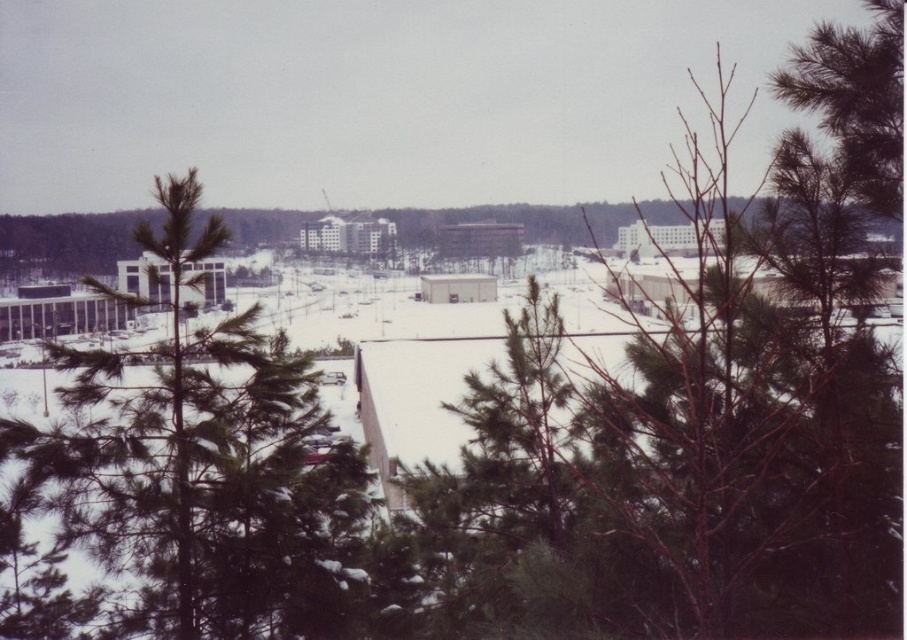
Question: Is green leafy tree at center thinner than green needle-like tree at center?

Choices:
 (A) no
 (B) yes

Answer: (A)

Question: Which of the following is the closest to the observer?

Choices:
 (A) (840, 202)
 (B) (193, 513)

Answer: (A)

Question: Which of the following is the closest to the observer?

Choices:
 (A) green needle-like tree at center
 (B) green leafy tree at center

Answer: (B)

Question: Does green leafy tree at center have a larger size compared to green needle-like tree at center?

Choices:
 (A) yes
 (B) no

Answer: (A)

Question: Does green leafy tree at center appear over green needle-like tree at center?

Choices:
 (A) yes
 (B) no

Answer: (A)